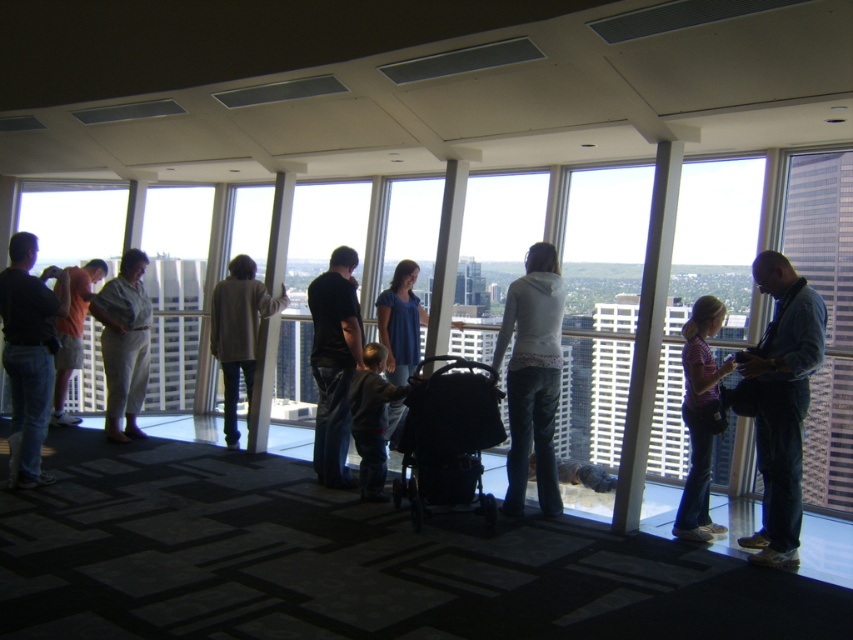
Question: Is denim jeans at center above dark gray fleece jacket at center?

Choices:
 (A) no
 (B) yes

Answer: (B)

Question: Which object is the closest to the light green fabric shirt at center?

Choices:
 (A) orange t-shirt at left
 (B) blue cotton shirt at center
 (C) transparent glass window at right
 (D) dark blue jeans at left

Answer: (A)

Question: Which point is closer to the camera taking this photo?

Choices:
 (A) (265, 300)
 (B) (523, 381)
 (C) (363, 435)
 (D) (811, 499)

Answer: (B)

Question: Is dark gray fleece jacket at center smaller than orange t-shirt at left?

Choices:
 (A) no
 (B) yes

Answer: (B)

Question: Can you confirm if black cotton shirt at center is positioned below blue cotton shirt at center?

Choices:
 (A) yes
 (B) no

Answer: (A)

Question: Which of the following is the farthest from the observer?

Choices:
 (A) (825, 456)
 (B) (73, 308)

Answer: (B)